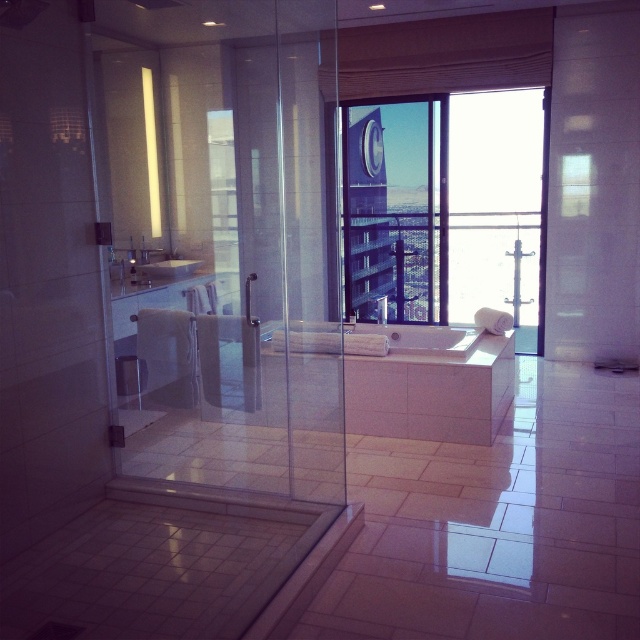
Does white glossy bathtub at center have a lesser width compared to white glossy sink at center?

In fact, white glossy bathtub at center might be wider than white glossy sink at center.

Which is below, white glossy bathtub at center or white glossy sink at center?

white glossy bathtub at center is lower down.

This screenshot has height=640, width=640. Describe the element at coordinates (380, 339) in the screenshot. I see `white glossy bathtub at center` at that location.

The width and height of the screenshot is (640, 640). I want to click on white glossy bathtub at center, so click(x=380, y=339).

Can you confirm if transparent glass screen door at left is bigger than white glossy bathtub at center?

Correct, transparent glass screen door at left is larger in size than white glossy bathtub at center.

At what (x,y) coordinates should I click in order to perform the action: click on transparent glass screen door at left. Please return your answer as a coordinate pair (x, y). The height and width of the screenshot is (640, 640). Looking at the image, I should click on (221, 237).

Is transparent glass window at center bigger than white glossy bathtub at center?

Indeed, transparent glass window at center has a larger size compared to white glossy bathtub at center.

Is transparent glass window at center positioned at the back of white glossy bathtub at center?

That is True.

Locate an element on the screen. The height and width of the screenshot is (640, 640). transparent glass window at center is located at coordinates (444, 209).

Where is `transparent glass window at center`? transparent glass window at center is located at coordinates (444, 209).